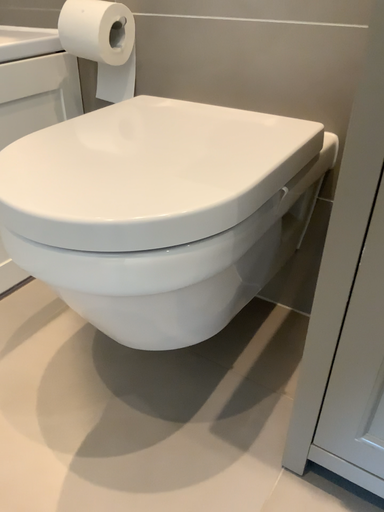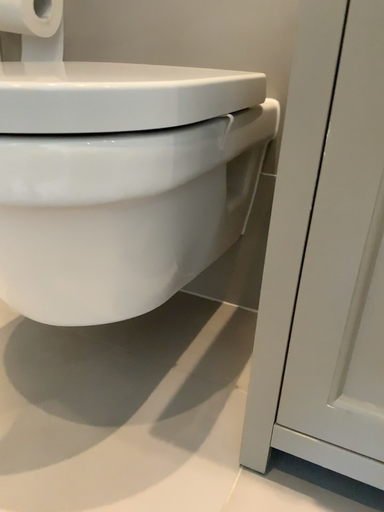
Question: How did the camera likely rotate when shooting the video?

Choices:
 (A) rotated upward
 (B) rotated downward

Answer: (A)